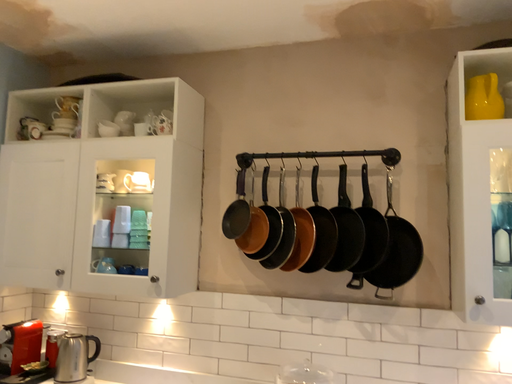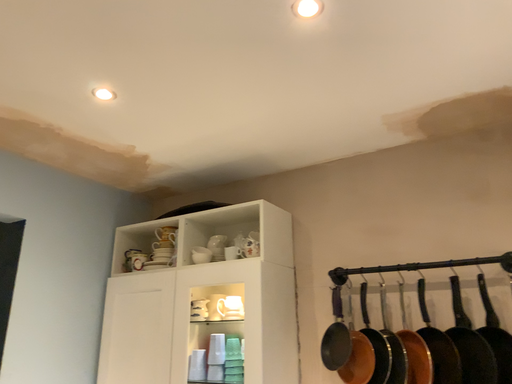
Question: Which way did the camera rotate in the video?

Choices:
 (A) rotated left
 (B) rotated right

Answer: (A)